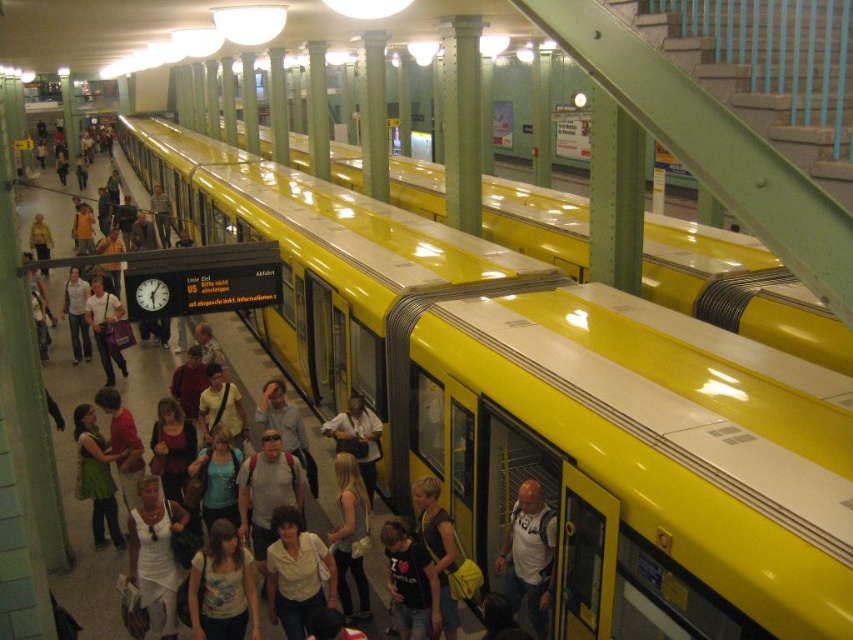
Does yellow matte train at center appear on the right side of yellow glossy train at center?

Indeed, yellow matte train at center is positioned on the right side of yellow glossy train at center.

Between yellow matte train at center and yellow glossy train at center, which one has more height?

Standing taller between the two is yellow glossy train at center.

Is point (749, 636) in front of point (579, 216)?

Yes, it is.

Image resolution: width=853 pixels, height=640 pixels. Find the location of `yellow matte train at center`. yellow matte train at center is located at coordinates 550,404.